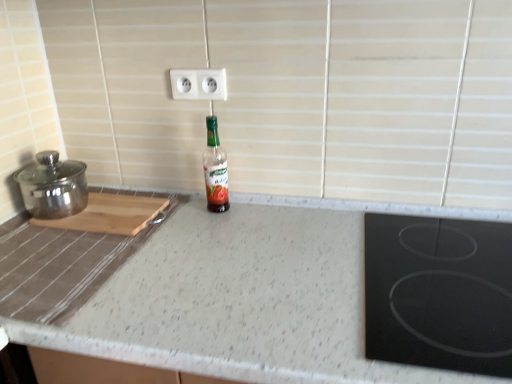
Question: From a real-world perspective, does green glass bottle at center sit lower than wooden cutting board at left?

Choices:
 (A) no
 (B) yes

Answer: (A)

Question: Is wooden cutting board at left a part of green glass bottle at center?

Choices:
 (A) yes
 (B) no

Answer: (B)

Question: Is green glass bottle at center further to camera compared to wooden cutting board at left?

Choices:
 (A) no
 (B) yes

Answer: (B)

Question: From the image's perspective, is green glass bottle at center below wooden cutting board at left?

Choices:
 (A) no
 (B) yes

Answer: (A)

Question: Is green glass bottle at center wider than wooden cutting board at left?

Choices:
 (A) no
 (B) yes

Answer: (A)

Question: Is green glass bottle at center bigger than wooden cutting board at left?

Choices:
 (A) yes
 (B) no

Answer: (B)

Question: Does white plastic electric outlet at upper center appear on the right side of polished stainless steel pot at left?

Choices:
 (A) yes
 (B) no

Answer: (A)

Question: Would you say white plastic electric outlet at upper center is a long distance from polished stainless steel pot at left?

Choices:
 (A) yes
 (B) no

Answer: (B)

Question: Does white plastic electric outlet at upper center have a larger size compared to polished stainless steel pot at left?

Choices:
 (A) yes
 (B) no

Answer: (B)

Question: Can you confirm if white plastic electric outlet at upper center is thinner than polished stainless steel pot at left?

Choices:
 (A) yes
 (B) no

Answer: (A)

Question: From the image's perspective, is white plastic electric outlet at upper center on polished stainless steel pot at left?

Choices:
 (A) no
 (B) yes

Answer: (B)

Question: Can you confirm if white plastic electric outlet at upper center is shorter than polished stainless steel pot at left?

Choices:
 (A) no
 (B) yes

Answer: (B)

Question: Is polished stainless steel pot at left positioned behind green glass bottle at center?

Choices:
 (A) yes
 (B) no

Answer: (B)